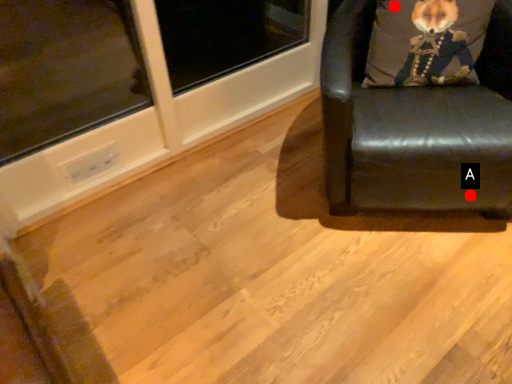
Question: Two points are circled on the image, labeled by A and B beside each circle. Which point is further to the camera?

Choices:
 (A) A is further
 (B) B is further

Answer: (B)